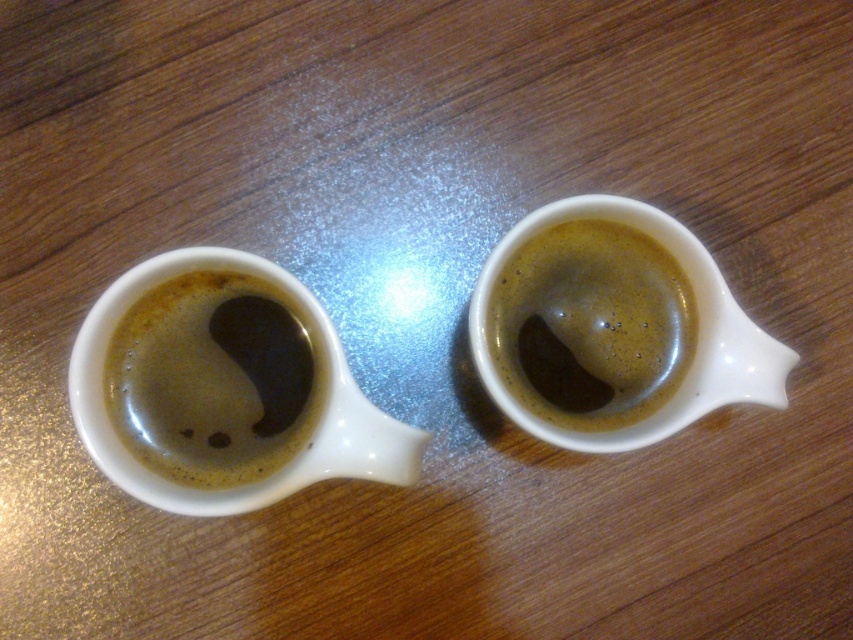
You are holding a smartphone camera and want to take a photo of the white ceramic mug at left. Based on its distance from you, will it appear larger or smaller in the photo compared to if it were closer?

The white ceramic mug at left is 28.70 inches from viewer, so it will appear smaller in the photo compared to if it were closer.